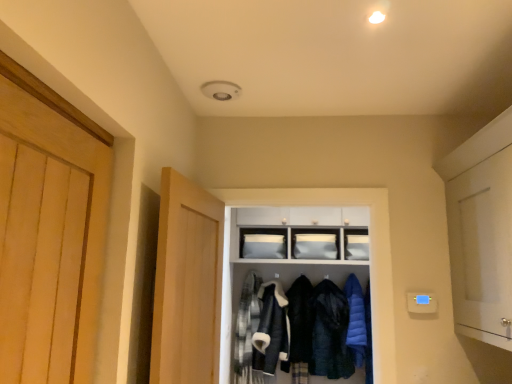
Question: Is dark blue wool coat at center, the 3th clothing in the right-to-left sequence, behind light wood door at center, marked as the 1th door in a left-to-right arrangement?

Choices:
 (A) yes
 (B) no

Answer: (A)

Question: Is light wood door at center, the second door viewed from the right, inside dark blue wool coat at center, the 3th clothing in the right-to-left sequence?

Choices:
 (A) yes
 (B) no

Answer: (B)

Question: Is dark blue wool coat at center, the 3th clothing in the right-to-left sequence, to the right of light wood door at center, marked as the 1th door in a left-to-right arrangement, from the viewer's perspective?

Choices:
 (A) no
 (B) yes

Answer: (B)

Question: Can you confirm if dark blue wool coat at center, which is the third clothing from left to right, is positioned to the left of light wood door at center, the second door viewed from the right?

Choices:
 (A) yes
 (B) no

Answer: (B)

Question: From a real-world perspective, is dark blue wool coat at center, which is the third clothing from left to right, over light wood door at center, the second door viewed from the right?

Choices:
 (A) yes
 (B) no

Answer: (B)

Question: Considering the positions of plaid fabric shirt at center, the 1th clothing viewed from the left, and matte white cabinet at center, the first cabinetry positioned from the top, in the image, is plaid fabric shirt at center, the 1th clothing viewed from the left, taller or shorter than matte white cabinet at center, the first cabinetry positioned from the top,?

Choices:
 (A) tall
 (B) short

Answer: (A)

Question: From the image's perspective, is plaid fabric shirt at center, the 1th clothing viewed from the left, positioned above or below matte white cabinet at center, the 2th cabinetry in the bottom-to-top sequence?

Choices:
 (A) below
 (B) above

Answer: (A)

Question: In the image, is plaid fabric shirt at center, the 1th clothing viewed from the left, on the left side or the right side of matte white cabinet at center, the first cabinetry positioned from the top?

Choices:
 (A) left
 (B) right

Answer: (A)

Question: Does point (242, 309) appear closer or farther from the camera than point (291, 236)?

Choices:
 (A) closer
 (B) farther

Answer: (B)

Question: Looking at their shapes, would you say white matte cabinet at right, which is the first door in right-to-left order, is wider or thinner than plaid fabric shirt at center, the 1th clothing viewed from the left?

Choices:
 (A) thin
 (B) wide

Answer: (B)

Question: Is white matte cabinet at right, which is the first door in right-to-left order, inside or outside of plaid fabric shirt at center, the 5th clothing when ordered from right to left?

Choices:
 (A) inside
 (B) outside

Answer: (B)

Question: Considering the positions of white matte cabinet at right, which is the first door in right-to-left order, and plaid fabric shirt at center, the 5th clothing when ordered from right to left, in the image, is white matte cabinet at right, which is the first door in right-to-left order, taller or shorter than plaid fabric shirt at center, the 5th clothing when ordered from right to left,?

Choices:
 (A) short
 (B) tall

Answer: (A)

Question: In the image, is white matte cabinet at right, which is the first door in right-to-left order, positioned in front of or behind plaid fabric shirt at center, the 5th clothing when ordered from right to left?

Choices:
 (A) front
 (B) behind

Answer: (A)

Question: Relative to dark blue wool coat at center, which is the third clothing from left to right, is plaid fabric shirt at center, the 5th clothing when ordered from right to left, in front or behind?

Choices:
 (A) behind
 (B) front

Answer: (A)

Question: Considering the positions of point (246, 364) and point (306, 355), is point (246, 364) closer or farther from the camera than point (306, 355)?

Choices:
 (A) closer
 (B) farther

Answer: (B)